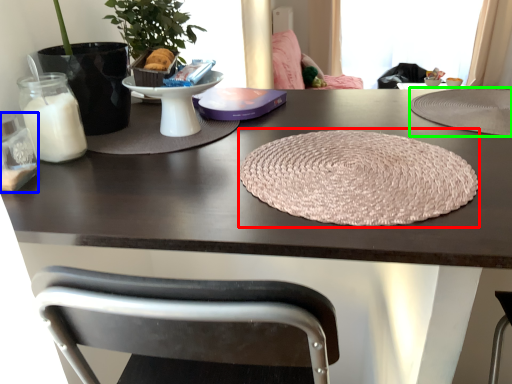
Question: Which is farther away from yoga mat (highlighted by a red box)? candle holder (highlighted by a blue box) or mat (highlighted by a green box)?

Choices:
 (A) candle holder
 (B) mat

Answer: (A)